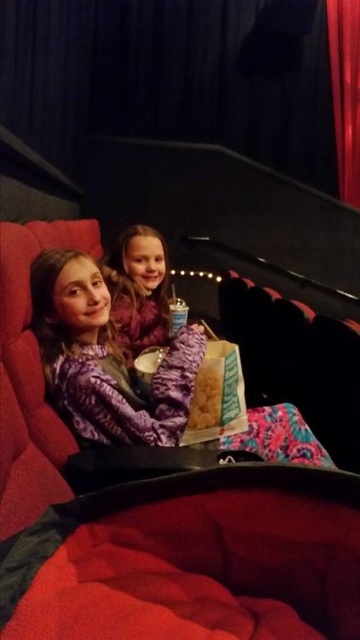
Question: Which object is the farthest from the purple patterned sweater at center?

Choices:
 (A) dark blue velvet curtain at upper center
 (B) velvet red curtain at right
 (C) matte purple dress at center

Answer: (B)

Question: Does dark blue velvet curtain at upper center appear on the right side of matte purple dress at center?

Choices:
 (A) yes
 (B) no

Answer: (A)

Question: Which point is farther to the camera?

Choices:
 (A) matte purple dress at center
 (B) purple patterned sweater at center
 (C) velvet red curtain at right

Answer: (C)

Question: Is dark blue velvet curtain at upper center in front of purple patterned sweater at center?

Choices:
 (A) yes
 (B) no

Answer: (B)

Question: Is dark blue velvet curtain at upper center further to camera compared to velvet red curtain at right?

Choices:
 (A) yes
 (B) no

Answer: (B)

Question: Which point is closer to the camera?

Choices:
 (A) (267, 417)
 (B) (302, 176)

Answer: (A)